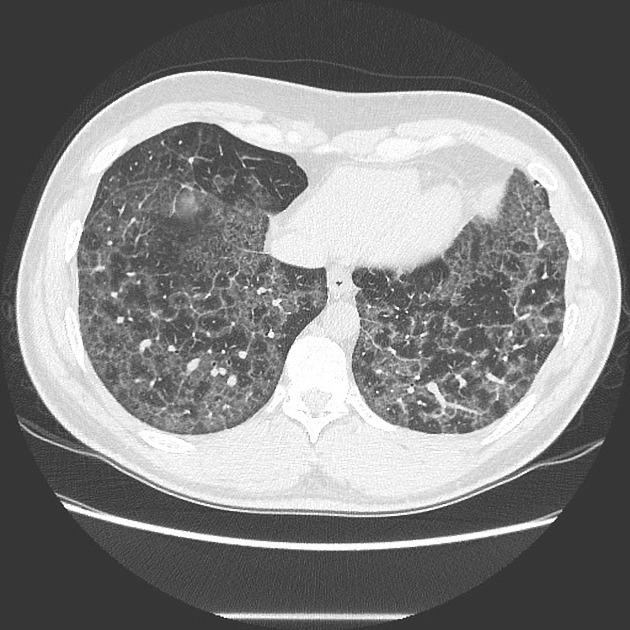
The height and width of the screenshot is (630, 630). What are the coordinates of `bowl-like object` in the screenshot? It's located at (541, 488).